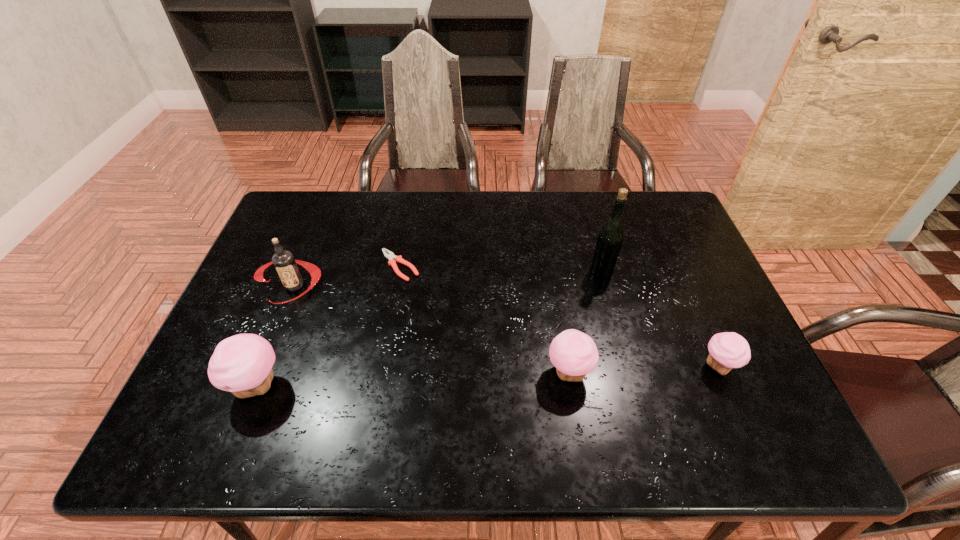
You are a GUI agent. You are given a task and a screenshot of the screen. Output one action in this format:
    pyautogui.click(x=<x>, y=<y>)
    Task: Click on the free space that satisfies the following two spatial constraints: 1. on the back side of the leftmost cupcake; 2. on the left side of the fifth object from left to right
    This screenshot has width=960, height=540.
    Given the screenshot: What is the action you would take?
    pyautogui.click(x=302, y=272)

Identify the location of free point that satisfies the following two spatial constraints: 1. on the label of the root beer; 2. on the right side of the second cupcake from left to right. (259, 372).

At what (x,y) coordinates should I click in order to perform the action: click on blank space that satisfies the following two spatial constraints: 1. on the front side of the fourth object from right to left; 2. on the right side of the beer bottle. Please return your answer as a coordinate pair (x, y). Looking at the image, I should click on (398, 272).